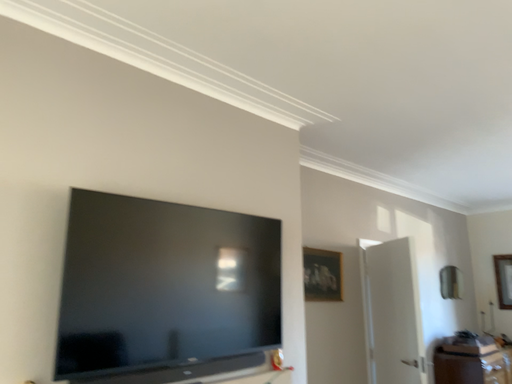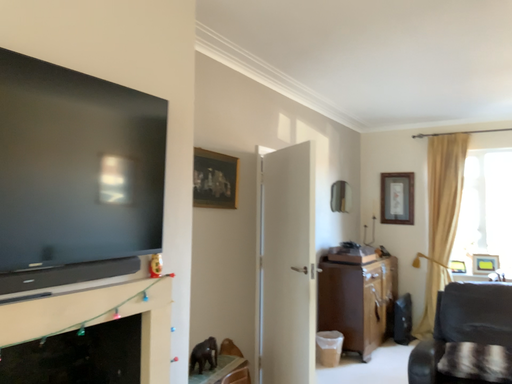
Question: Which way did the camera rotate in the video?

Choices:
 (A) rotated upward
 (B) rotated downward

Answer: (B)